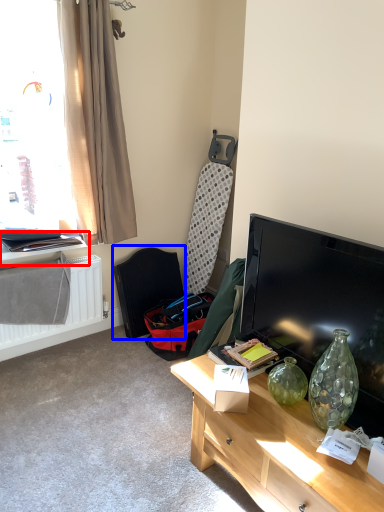
Question: Which object is closer to the camera taking this photo, window sill (highlighted by a red box) or swivel chair (highlighted by a blue box)?

Choices:
 (A) window sill
 (B) swivel chair

Answer: (A)